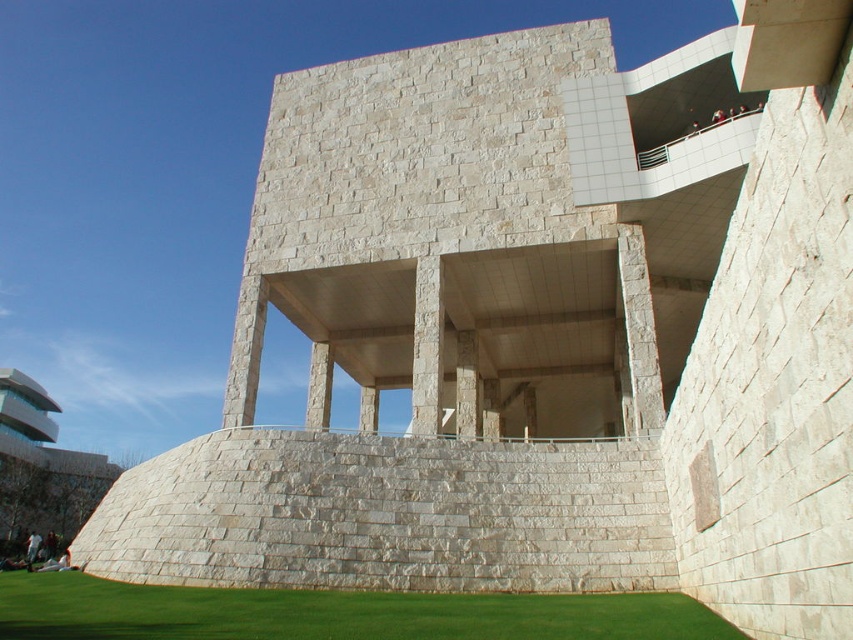
Question: Does green grass at lower center appear under natural stone column at center?

Choices:
 (A) no
 (B) yes

Answer: (B)

Question: Is green grass at lower center above natural stone column at center?

Choices:
 (A) no
 (B) yes

Answer: (A)

Question: Which point is farther to the camera?

Choices:
 (A) (439, 378)
 (B) (189, 618)

Answer: (A)

Question: Among these points, which one is nearest to the camera?

Choices:
 (A) (428, 296)
 (B) (173, 589)

Answer: (B)

Question: Among these objects, which one is farthest from the camera?

Choices:
 (A) green grass at lower center
 (B) natural stone column at center

Answer: (B)

Question: Is green grass at lower center behind natural stone column at center?

Choices:
 (A) yes
 (B) no

Answer: (B)